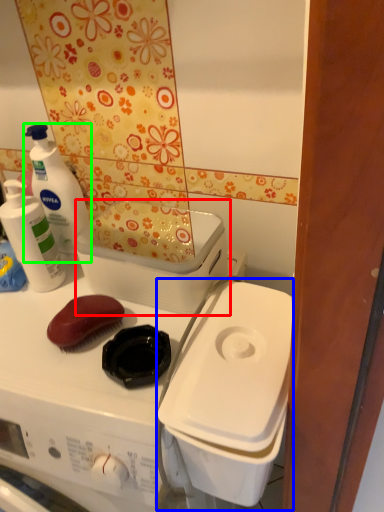
Question: Based on their relative distances, which object is nearer to appliance (highlighted by a red box)? Choose from appliance (highlighted by a blue box) and cleaning product (highlighted by a green box).

Choices:
 (A) appliance
 (B) cleaning product

Answer: (A)